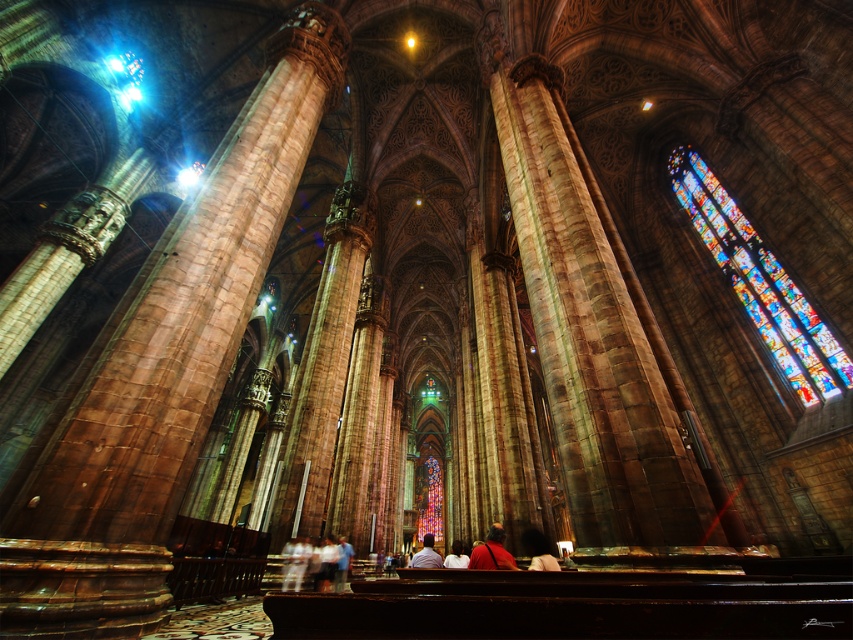
You are standing in the cathedral and notice the stained glass at upper right and the smooth skin person at center. Which object is shorter in height?

The stained glass at upper right is not as tall as the smooth skin person at center, so the stained glass at upper right is shorter in height.

You are standing in the cathedral and want to take a photo of the smooth skin person at center without the stained glass at upper right appearing in the background. Is this possible given their positions?

The stained glass at upper right is positioned on the right side of smooth skin person at center. Therefore, if you position yourself to the left of the smooth skin person at center, you can frame the shot so that the stained glass at upper right is out of the background view.

You are standing in the cathedral and want to take a photo of both the point at coordinates point (270,148) and the point at coordinates point (505,561). Based on their positions, which point is closer to your camera?

Point (270,148) is closer to the camera than point (505,561) because it is further to the camera than the other point.